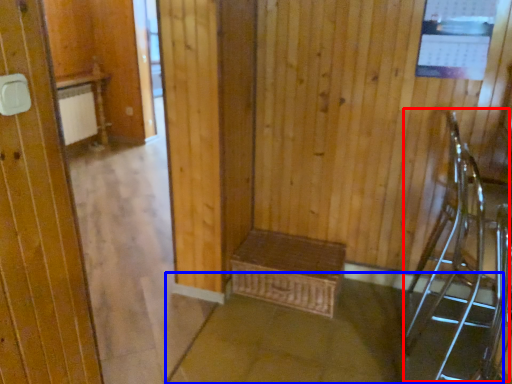
Question: Which object is closer to the camera taking this photo, armchair (highlighted by a red box) or concrete (highlighted by a blue box)?

Choices:
 (A) armchair
 (B) concrete

Answer: (A)